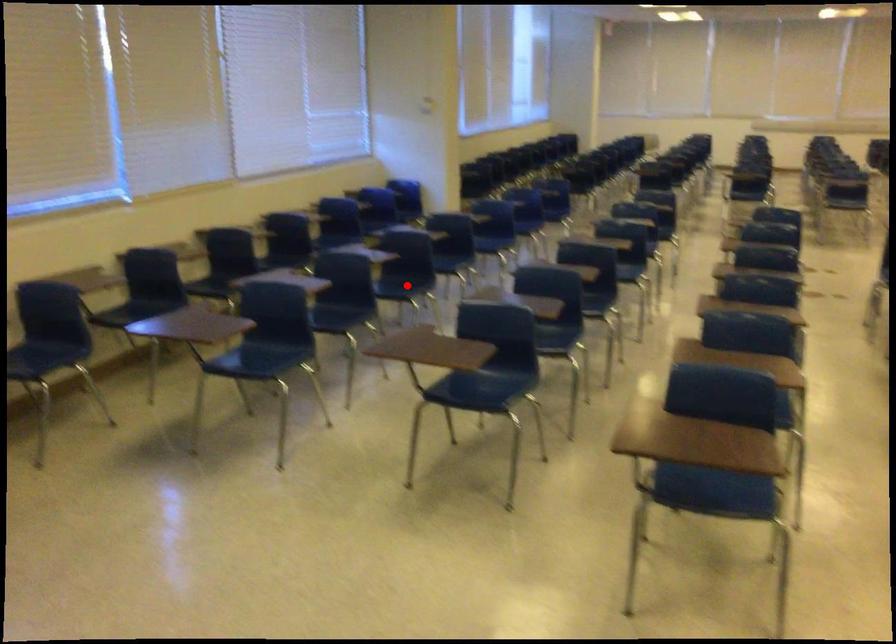
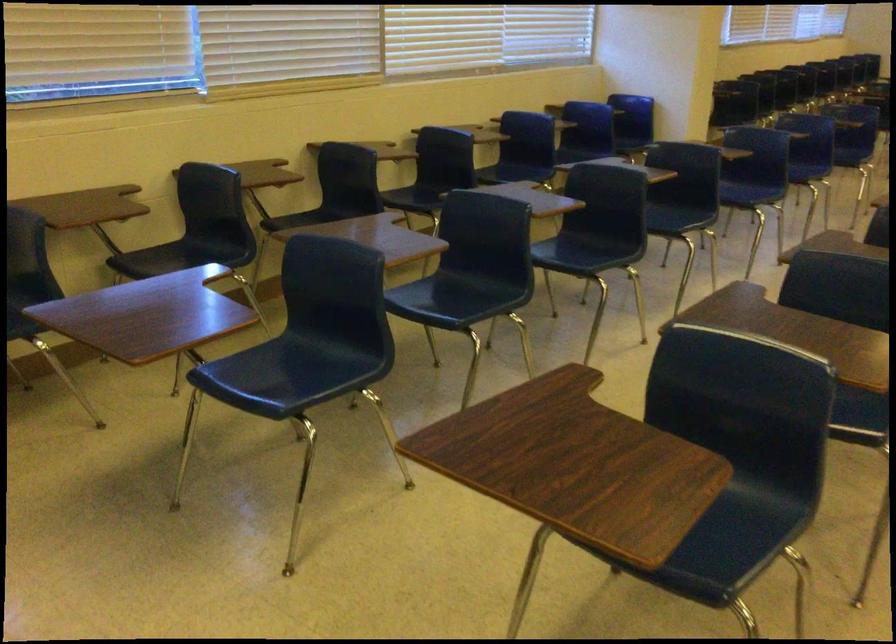
Question: I am providing you with two images of the same scene from different viewpoints. Image1 has a red point marked. In image2, the corresponding 3D location appears at what relative position? Reply with the corresponding letter.

Choices:
 (A) Closer
 (B) Farther

Answer: (A)